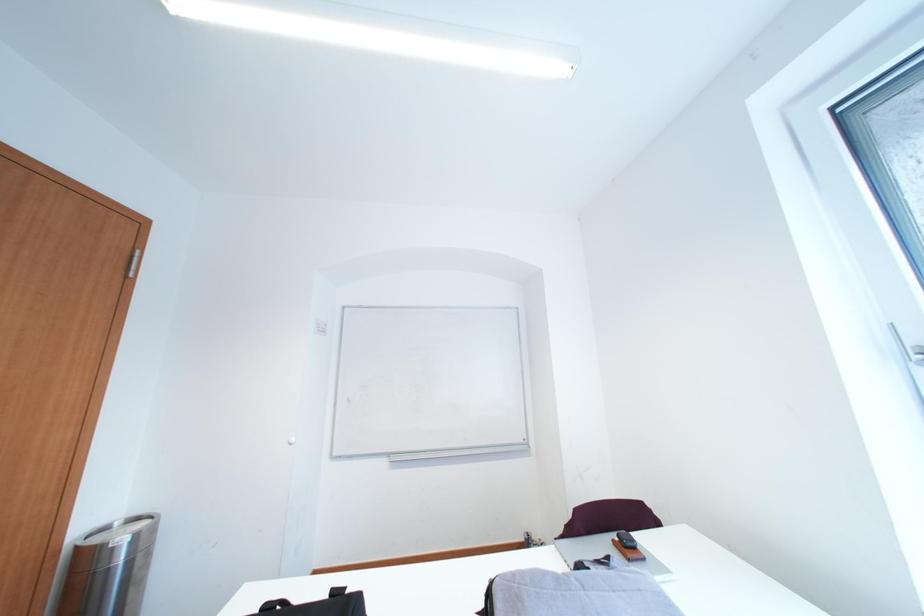
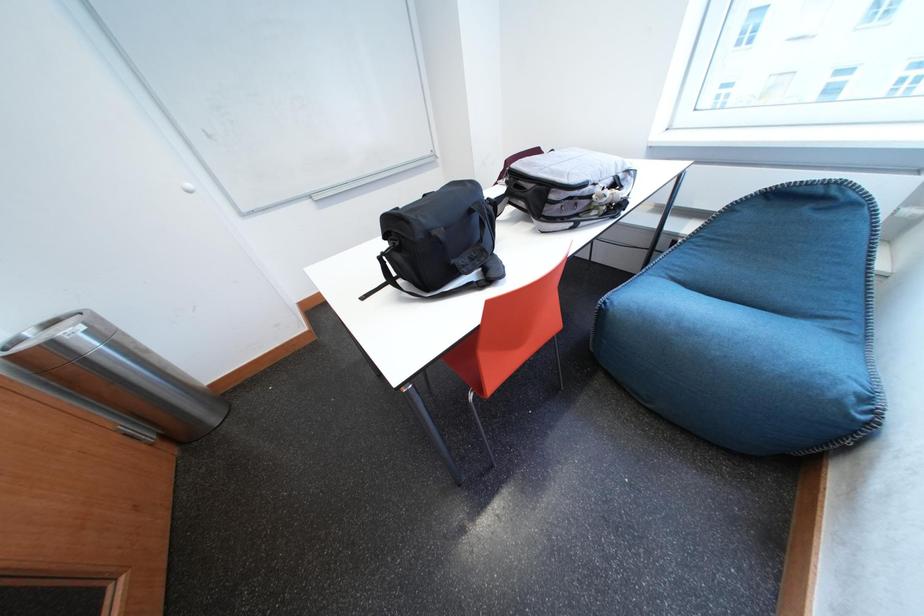
The first image is from the beginning of the video and the second image is from the end. How did the camera likely rotate when shooting the video?

The camera's rotation is toward right-down.